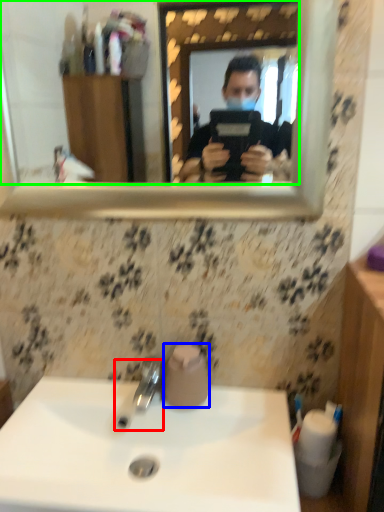
Question: Based on their relative distances, which object is farther from tap (highlighted by a red box)? Choose from toilet paper (highlighted by a blue box) and mirror (highlighted by a green box).

Choices:
 (A) toilet paper
 (B) mirror

Answer: (B)